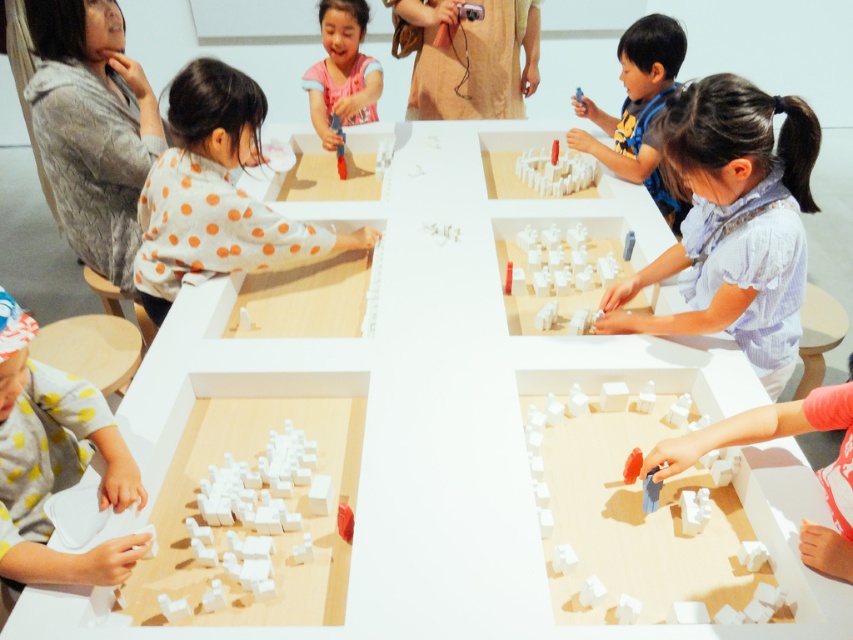
Question: Is white matte figure at center below white matte toy at center?

Choices:
 (A) yes
 (B) no

Answer: (A)

Question: Is blue plastic toy at lower right thinner than white matte toy at center?

Choices:
 (A) yes
 (B) no

Answer: (A)

Question: Which of the following is the closest to the observer?

Choices:
 (A) white matte toy at center
 (B) blue plastic toy at lower right
 (C) white matte building blocks at lower left

Answer: (B)

Question: Which point appears farthest from the camera in this image?

Choices:
 (A) (791, 328)
 (B) (115, 547)
 (C) (639, 461)

Answer: (A)

Question: Is matte pink shirt at upper center bigger than matte plastic toy at center?

Choices:
 (A) no
 (B) yes

Answer: (B)

Question: Estimate the real-world distances between objects in this image. Which object is closer to the yellow polka dot fabric at lower left?

Choices:
 (A) blue fabric shirt at upper right
 (B) matte orange toy at lower right

Answer: (B)